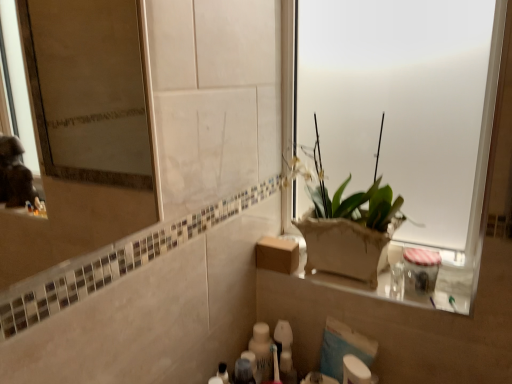
Question: In the image, is matte brown pot at center positioned in front of or behind translucent plastic toothbrush at lower center, the 3th toiletry from the left?

Choices:
 (A) front
 (B) behind

Answer: (A)

Question: Based on their positions, is matte brown pot at center located to the left or right of translucent plastic toothbrush at lower center, the 3th toiletry from the left?

Choices:
 (A) right
 (B) left

Answer: (A)

Question: Considering the real-world distances, which object is closest to the matte brown pot at center?

Choices:
 (A) white frosted glass at upper right
 (B) white glossy bottle at lower center, which is the 2th toiletry in left-to-right order
 (C) brown cardboard box at center
 (D) white matte toilet paper at lower center
 (E) translucent plastic toothbrush at lower center, the 3th toiletry from the left

Answer: (A)

Question: Estimate the real-world distances between objects in this image. Which object is closer to the white glossy bottle at lower center, which ranks as the 3th toiletry in right-to-left order?

Choices:
 (A) clear plastic jar at lower center, which is the 1th toiletry from right to left
 (B) matte brown pot at center
 (C) white glossy bottle at lower center, which is the fourth toiletry in right-to-left order
 (D) translucent plastic toothbrush at lower center, the 3th toiletry from the left
 (E) white frosted glass at upper right

Answer: (D)